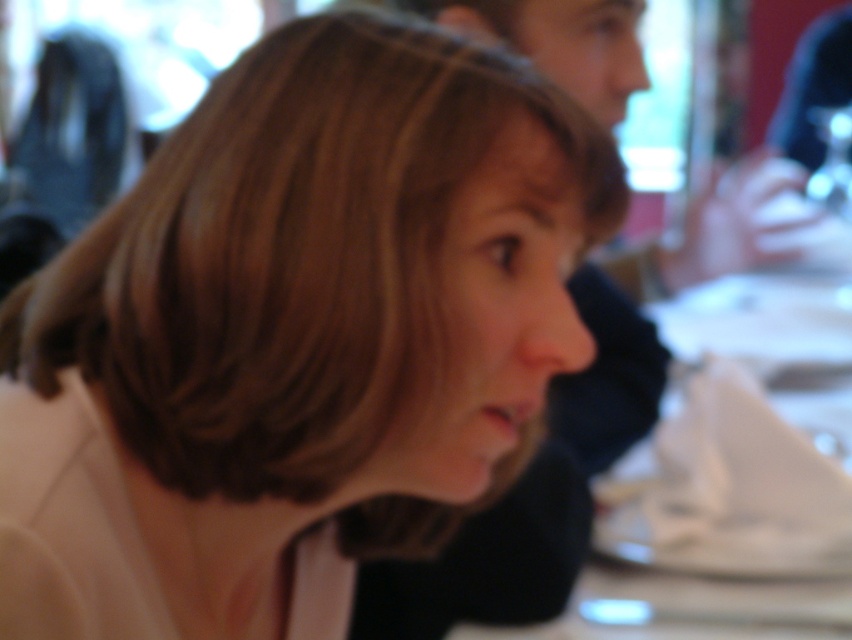
Question: Which object appears closest to the camera in this image?

Choices:
 (A) smooth beige hair at center
 (B) white fabric table at center

Answer: (A)

Question: Observing the image, what is the correct spatial positioning of smooth beige hair at center in reference to white fabric table at center?

Choices:
 (A) below
 (B) above

Answer: (A)

Question: Where is smooth beige hair at center located in relation to white fabric table at center in the image?

Choices:
 (A) right
 (B) left

Answer: (B)

Question: Can you confirm if smooth beige hair at center is positioned below white fabric table at center?

Choices:
 (A) no
 (B) yes

Answer: (B)

Question: Which object is farther from the camera taking this photo?

Choices:
 (A) smooth beige hair at center
 (B) white fabric table at center

Answer: (B)